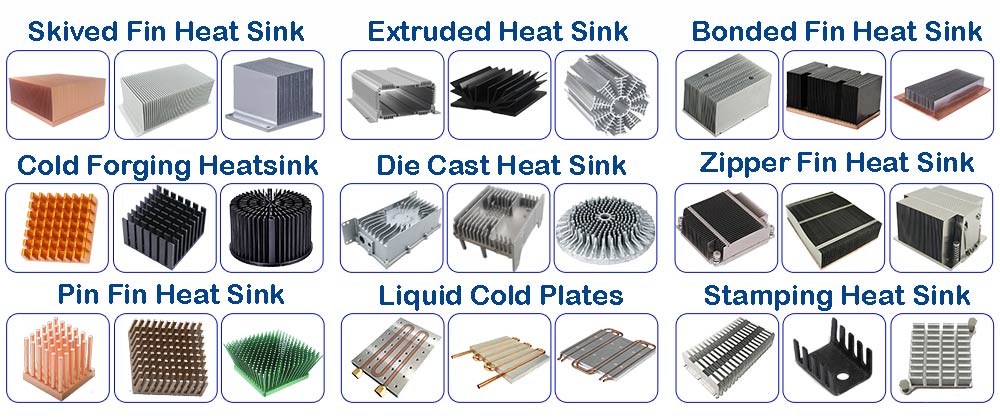
The width and height of the screenshot is (1000, 420). I want to click on heat duct, so point(951,102).